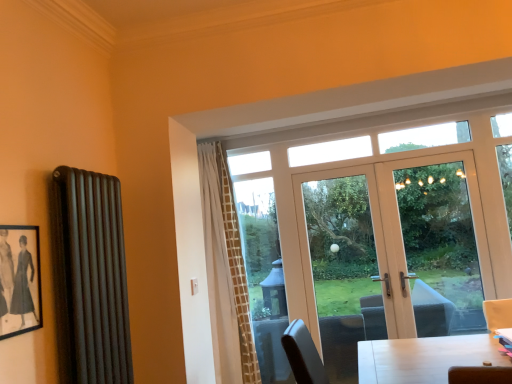
Measure the distance between point (229, 334) and camera.

They are 3.48 meters apart.

Identify the location of transparent glass door at center, the second window screen positioned from the back. (440, 232).

The height and width of the screenshot is (384, 512). Describe the element at coordinates (261, 247) in the screenshot. I see `clear glass window at center, the 2th window screen viewed from the right` at that location.

Measure the distance between white glossy door at center and camera.

They are 3.28 meters apart.

The width and height of the screenshot is (512, 384). Describe the element at coordinates (19, 280) in the screenshot. I see `black matte picture frame at left` at that location.

Image resolution: width=512 pixels, height=384 pixels. I want to click on white textured curtain at center, so click(x=225, y=274).

Is point (440, 223) positioned in front of point (269, 276)?

Yes.

From their relative heights in the image, would you say transparent glass door at center, which is the second window screen from left to right, is taller or shorter than clear glass window at center, placed as the first window screen when sorted from left to right?

Clearly, transparent glass door at center, which is the second window screen from left to right, is shorter compared to clear glass window at center, placed as the first window screen when sorted from left to right.

Which object is positioned more to the right, transparent glass door at center, which is the second window screen from left to right, or clear glass window at center, placed as the first window screen when sorted from left to right?

Positioned to the right is transparent glass door at center, which is the second window screen from left to right.

Between point (469, 250) and point (453, 258), which one is positioned in front?

The point (469, 250) is closer.

Can white glossy door at center be found inside transparent glass door at center, which is the second window screen from left to right?

No, white glossy door at center is not surrounded by transparent glass door at center, which is the second window screen from left to right.

Does transparent glass door at center, the 1th window screen viewed from the front, have a greater height compared to white glossy door at center?

No, transparent glass door at center, the 1th window screen viewed from the front, is not taller than white glossy door at center.

From the image's perspective, which is below, transparent glass door at center, the 1th window screen in the right-to-left sequence, or white glossy door at center?

white glossy door at center appears lower in the image.

Could you tell me if white textured curtain at center is turned towards matte black radiator at left?

Yes, white textured curtain at center is oriented towards matte black radiator at left.

Considering the sizes of objects white textured curtain at center and matte black radiator at left in the image provided, who is shorter, white textured curtain at center or matte black radiator at left?

matte black radiator at left is shorter.

Are white textured curtain at center and matte black radiator at left located far from each other?

Yes.

Looking at this image, from a real-world perspective, is white textured curtain at center over matte black radiator at left?

Incorrect, from a real-world perspective, white textured curtain at center is lower than matte black radiator at left.

Considering the relative sizes of black matte picture frame at left and white glossy door at center in the image provided, is black matte picture frame at left shorter than white glossy door at center?

Yes, black matte picture frame at left is shorter than white glossy door at center.

In terms of width, does black matte picture frame at left look wider or thinner when compared to white glossy door at center?

Considering their sizes, black matte picture frame at left looks slimmer than white glossy door at center.

Are black matte picture frame at left and white glossy door at center making contact?

No, black matte picture frame at left is not next to white glossy door at center.

Is the depth of black matte picture frame at left less than that of white glossy door at center?

Yes, it is.

Is transparent glass door at center, the 1th window screen in the right-to-left sequence, oriented away from white textured curtain at center?

No, white textured curtain at center is not at the back of transparent glass door at center, the 1th window screen in the right-to-left sequence.

Is transparent glass door at center, which is the second window screen from left to right, to the left of white textured curtain at center from the viewer's perspective?

In fact, transparent glass door at center, which is the second window screen from left to right, is to the right of white textured curtain at center.

Is point (430, 217) positioned in front of point (226, 296)?

That is False.

Between transparent glass door at center, which is the second window screen from left to right, and white textured curtain at center, which one has less height?

With less height is transparent glass door at center, which is the second window screen from left to right.

Is the surface of black matte picture frame at left in direct contact with clear glass door at center?

black matte picture frame at left and clear glass door at center are not in contact.

Is the depth of black matte picture frame at left greater than that of clear glass door at center?

Result: No, black matte picture frame at left is closer to the camera.

From the image's perspective, is black matte picture frame at left over clear glass door at center?

Yes, from the image's perspective, black matte picture frame at left is over clear glass door at center.

Considering the positions of points (12, 324) and (377, 194), is point (12, 324) farther from camera compared to point (377, 194)?

No, (12, 324) is in front of (377, 194).

Considering the positions of objects white glossy door at center and matte black radiator at left in the image provided, who is behind, white glossy door at center or matte black radiator at left?

white glossy door at center is further from the camera.

From the image's perspective, between white glossy door at center and matte black radiator at left, which one is located above?

matte black radiator at left appears higher in the image.

Is white glossy door at center at the left side of matte black radiator at left?

No.

What are the coordinates of `window screen lying on the left of transparent glass door at center, which is the second window screen from left to right` in the screenshot? It's located at (261, 247).

Image resolution: width=512 pixels, height=384 pixels. Find the location of `door below the transparent glass door at center, the 1th window screen viewed from the front (from a real-world perspective)`. door below the transparent glass door at center, the 1th window screen viewed from the front (from a real-world perspective) is located at coordinates (395, 247).

Considering their positions, is clear glass door at center positioned closer to black matte picture frame at left than matte black radiator at left?

Among the two, matte black radiator at left is located nearer to black matte picture frame at left.

From the image, which object appears to be farther from matte black radiator at left, white glossy door at center or transparent glass door at center, the 1th window screen in the right-to-left sequence?

transparent glass door at center, the 1th window screen in the right-to-left sequence, lies further to matte black radiator at left than the other object.

Considering their positions, is white textured curtain at center positioned further to white glossy door at center than black matte picture frame at left?

Based on the image, black matte picture frame at left appears to be further to white glossy door at center.

Estimate the real-world distances between objects in this image. Which object is further from black matte picture frame at left, white textured curtain at center or clear glass door at center?

clear glass door at center is further to black matte picture frame at left.

Based on their spatial positions, is matte black radiator at left or black matte picture frame at left closer to white textured curtain at center?

Based on the image, matte black radiator at left appears to be nearer to white textured curtain at center.

Which object lies nearer to the anchor point matte black radiator at left, transparent glass door at center, which is the second window screen from left to right, or white glossy door at center?

The object closer to matte black radiator at left is white glossy door at center.

Estimate the real-world distances between objects in this image. Which object is further from clear glass door at center, matte black radiator at left or white glossy door at center?

Based on the image, matte black radiator at left appears to be further to clear glass door at center.

Based on the photo, estimate the real-world distances between objects in this image. Which object is further from white glossy door at center, clear glass door at center or white textured curtain at center?

Answer: The object further to white glossy door at center is white textured curtain at center.

This screenshot has height=384, width=512. In order to click on curtain positioned between black matte picture frame at left and clear glass door at center from near to far in this screenshot , I will do `click(225, 274)`.

Image resolution: width=512 pixels, height=384 pixels. Identify the location of door positioned between black matte picture frame at left and clear glass door at center from near to far. (395, 247).

Find the location of a particular element. The height and width of the screenshot is (384, 512). curtain between matte black radiator at left and transparent glass door at center, the second window screen positioned from the back, in the horizontal direction is located at coordinates pyautogui.click(x=225, y=274).

You are a GUI agent. You are given a task and a screenshot of the screen. Output one action in this format:
    pyautogui.click(x=<x>, y=<y>)
    Task: Click on the screen door positioned between matte black radiator at left and clear glass window at center, the 2th window screen viewed from the right, from near to far
    
    Given the screenshot: What is the action you would take?
    pyautogui.click(x=308, y=236)